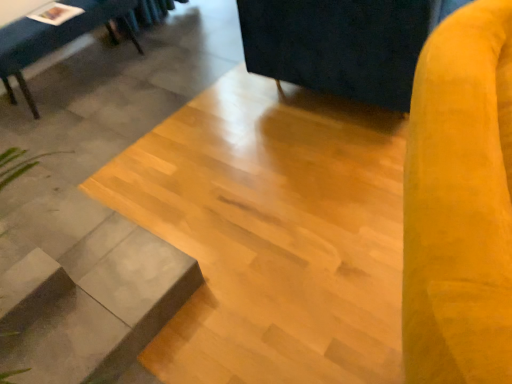
Locate an element on the screen. The width and height of the screenshot is (512, 384). matte black table at upper left is located at coordinates (55, 38).

What do you see at coordinates (55, 38) in the screenshot? This screenshot has width=512, height=384. I see `matte black table at upper left` at bounding box center [55, 38].

Based on the photo, measure the distance between velvet yellow swivel chair at right, the 1th swivel chair viewed from the back, and camera.

A distance of 4.82 feet exists between velvet yellow swivel chair at right, the 1th swivel chair viewed from the back, and camera.

Measure the distance between gray concrete at lower left and camera.

The distance of gray concrete at lower left from camera is 1.28 meters.

What do you see at coordinates (273, 234) in the screenshot? The image size is (512, 384). I see `gray concrete at lower left` at bounding box center [273, 234].

Image resolution: width=512 pixels, height=384 pixels. In order to click on matte black table at upper left in this screenshot , I will do coord(55,38).

From a real-world perspective, is matte black table at upper left over velvet yellow swivel chair at right, which is counted as the first swivel chair, starting from the front?

No, from a real-world perspective, matte black table at upper left is not on top of velvet yellow swivel chair at right, which is counted as the first swivel chair, starting from the front.

Is matte black table at upper left at the left side of velvet yellow swivel chair at right, acting as the second swivel chair starting from the back?

Yes.

In terms of size, does matte black table at upper left appear bigger or smaller than velvet yellow swivel chair at right, marked as the 1th swivel chair in a bottom-to-top arrangement?

Clearly, matte black table at upper left is smaller in size than velvet yellow swivel chair at right, marked as the 1th swivel chair in a bottom-to-top arrangement.

Between matte black table at upper left and velvet yellow swivel chair at right, which is the 2th swivel chair from top to bottom, which one is positioned behind?

Positioned behind is matte black table at upper left.

Does velvet yellow swivel chair at right, arranged as the first swivel chair when viewed from the top, contain velvet yellow swivel chair at right, marked as the 1th swivel chair in a bottom-to-top arrangement?

No, velvet yellow swivel chair at right, marked as the 1th swivel chair in a bottom-to-top arrangement, is not inside velvet yellow swivel chair at right, arranged as the first swivel chair when viewed from the top.

At what (x,y) coordinates should I click in order to perform the action: click on swivel chair that appears below the velvet yellow swivel chair at right, which is the 2th swivel chair from top to bottom (from a real-world perspective). Please return your answer as a coordinate pair (x, y). Looking at the image, I should click on (341, 44).

Considering the relative positions of velvet yellow swivel chair at right, arranged as the first swivel chair when viewed from the top, and velvet yellow swivel chair at right, which is the 2th swivel chair from top to bottom, in the image provided, is velvet yellow swivel chair at right, arranged as the first swivel chair when viewed from the top, to the left of velvet yellow swivel chair at right, which is the 2th swivel chair from top to bottom, from the viewer's perspective?

No.

Is velvet yellow swivel chair at right, the 1th swivel chair viewed from the back, positioned with its back to velvet yellow swivel chair at right, marked as the 1th swivel chair in a bottom-to-top arrangement?

velvet yellow swivel chair at right, the 1th swivel chair viewed from the back, does not have its back to velvet yellow swivel chair at right, marked as the 1th swivel chair in a bottom-to-top arrangement.

From the image's perspective, is velvet yellow swivel chair at right, arranged as the first swivel chair when viewed from the top, beneath gray concrete at lower left?

No, from the image's perspective, velvet yellow swivel chair at right, arranged as the first swivel chair when viewed from the top, is not beneath gray concrete at lower left.

Does velvet yellow swivel chair at right, arranged as the first swivel chair when viewed from the top, have a lesser width compared to gray concrete at lower left?

No.

Which point is more distant from viewer, (358, 17) or (370, 369)?

Positioned behind is point (358, 17).

Is velvet yellow swivel chair at right, which is counted as the first swivel chair, starting from the front, facing away from matte black table at upper left?

No, matte black table at upper left is not at the back of velvet yellow swivel chair at right, which is counted as the first swivel chair, starting from the front.

What's the angular difference between velvet yellow swivel chair at right, acting as the second swivel chair starting from the back, and matte black table at upper left's facing directions?

velvet yellow swivel chair at right, acting as the second swivel chair starting from the back, and matte black table at upper left are facing 22 degrees away from each other.

Which object is further away from the camera taking this photo, velvet yellow swivel chair at right, which is counted as the first swivel chair, starting from the front, or matte black table at upper left?

matte black table at upper left is further from the camera.

Is velvet yellow swivel chair at right, acting as the second swivel chair starting from the back, in contact with matte black table at upper left?

velvet yellow swivel chair at right, acting as the second swivel chair starting from the back, is not next to matte black table at upper left, and they're not touching.

Which is farther, (233, 169) or (50, 36)?

The point (50, 36) is farther from the camera.

Locate an element on the screen. The width and height of the screenshot is (512, 384). concrete lying below the matte black table at upper left (from the image's perspective) is located at coordinates (273, 234).

How much distance is there between gray concrete at lower left and matte black table at upper left?

A distance of 1.41 meters exists between gray concrete at lower left and matte black table at upper left.

What's the angular difference between gray concrete at lower left and matte black table at upper left's facing directions?

88.3 degrees separate the facing orientations of gray concrete at lower left and matte black table at upper left.

Considering the relative sizes of velvet yellow swivel chair at right, marked as the 1th swivel chair in a bottom-to-top arrangement, and velvet yellow swivel chair at right, the 1th swivel chair viewed from the back, in the image provided, is velvet yellow swivel chair at right, marked as the 1th swivel chair in a bottom-to-top arrangement, smaller than velvet yellow swivel chair at right, the 1th swivel chair viewed from the back,?

Yes.

Is velvet yellow swivel chair at right, acting as the second swivel chair starting from the back, looking in the opposite direction of velvet yellow swivel chair at right, arranged as the first swivel chair when viewed from the top?

That's not correct — velvet yellow swivel chair at right, acting as the second swivel chair starting from the back, is not looking away from velvet yellow swivel chair at right, arranged as the first swivel chair when viewed from the top.

How many degrees apart are the facing directions of velvet yellow swivel chair at right, which is counted as the first swivel chair, starting from the front, and velvet yellow swivel chair at right, which is counted as the 2th swivel chair, starting from the front?

velvet yellow swivel chair at right, which is counted as the first swivel chair, starting from the front, and velvet yellow swivel chair at right, which is counted as the 2th swivel chair, starting from the front, are facing 21.6 degrees away from each other.

In the image, there is a velvet yellow swivel chair at right, which is the 2th swivel chair from top to bottom. Where is `swivel chair below it (from a real-world perspective)`? This screenshot has height=384, width=512. swivel chair below it (from a real-world perspective) is located at coordinates (341, 44).

Visually, is gray concrete at lower left positioned to the left or to the right of velvet yellow swivel chair at right, arranged as the first swivel chair when viewed from the top?

gray concrete at lower left is positioned on velvet yellow swivel chair at right, arranged as the first swivel chair when viewed from the top,'s left side.

Is gray concrete at lower left turned away from velvet yellow swivel chair at right, arranged as the first swivel chair when viewed from the top?

gray concrete at lower left is not turned away from velvet yellow swivel chair at right, arranged as the first swivel chair when viewed from the top.

From their relative heights in the image, would you say gray concrete at lower left is taller or shorter than velvet yellow swivel chair at right, arranged as the first swivel chair when viewed from the top?

Clearly, gray concrete at lower left is shorter compared to velvet yellow swivel chair at right, arranged as the first swivel chair when viewed from the top.

Consider the image. Is gray concrete at lower left bigger than velvet yellow swivel chair at right, the 1th swivel chair viewed from the back?

Incorrect, gray concrete at lower left is not larger than velvet yellow swivel chair at right, the 1th swivel chair viewed from the back.

Locate an element on the screen. This screenshot has width=512, height=384. the 1st swivel chair counting from the right side of the matte black table at upper left is located at coordinates (460, 202).

At what (x,y) coordinates should I click in order to perform the action: click on swivel chair behind the velvet yellow swivel chair at right, which is the 2th swivel chair from top to bottom. Please return your answer as a coordinate pair (x, y). The width and height of the screenshot is (512, 384). Looking at the image, I should click on (341, 44).

Considering their positions, is velvet yellow swivel chair at right, which is the 2th swivel chair from top to bottom, positioned closer to velvet yellow swivel chair at right, which is counted as the second swivel chair, starting from the bottom, than gray concrete at lower left?

gray concrete at lower left is positioned closer to the anchor velvet yellow swivel chair at right, which is counted as the second swivel chair, starting from the bottom.

Considering their positions, is matte black table at upper left positioned closer to gray concrete at lower left than velvet yellow swivel chair at right, arranged as the first swivel chair when viewed from the top?

Among the two, velvet yellow swivel chair at right, arranged as the first swivel chair when viewed from the top, is located nearer to gray concrete at lower left.

Estimate the real-world distances between objects in this image. Which object is closer to velvet yellow swivel chair at right, which is counted as the second swivel chair, starting from the bottom, velvet yellow swivel chair at right, marked as the 1th swivel chair in a bottom-to-top arrangement, or matte black table at upper left?

velvet yellow swivel chair at right, marked as the 1th swivel chair in a bottom-to-top arrangement, is positioned closer to the anchor velvet yellow swivel chair at right, which is counted as the second swivel chair, starting from the bottom.

Looking at the image, which one is located further to gray concrete at lower left, velvet yellow swivel chair at right, which is counted as the second swivel chair, starting from the bottom, or velvet yellow swivel chair at right, which is the 2th swivel chair from top to bottom?

velvet yellow swivel chair at right, which is the 2th swivel chair from top to bottom.

From the image, which object appears to be farther from velvet yellow swivel chair at right, which is counted as the 2th swivel chair, starting from the front, gray concrete at lower left or velvet yellow swivel chair at right, which is the 2th swivel chair from top to bottom?

The object further to velvet yellow swivel chair at right, which is counted as the 2th swivel chair, starting from the front, is velvet yellow swivel chair at right, which is the 2th swivel chair from top to bottom.

Estimate the real-world distances between objects in this image. Which object is closer to matte black table at upper left, velvet yellow swivel chair at right, acting as the second swivel chair starting from the back, or gray concrete at lower left?

gray concrete at lower left is positioned closer to the anchor matte black table at upper left.

When comparing their distances from velvet yellow swivel chair at right, marked as the 1th swivel chair in a bottom-to-top arrangement, does matte black table at upper left or gray concrete at lower left seem further?

matte black table at upper left lies further to velvet yellow swivel chair at right, marked as the 1th swivel chair in a bottom-to-top arrangement, than the other object.

Based on their spatial positions, is matte black table at upper left or gray concrete at lower left further from velvet yellow swivel chair at right, arranged as the first swivel chair when viewed from the top?

matte black table at upper left is positioned further to the anchor velvet yellow swivel chair at right, arranged as the first swivel chair when viewed from the top.

Where is `concrete between matte black table at upper left and velvet yellow swivel chair at right, which is counted as the second swivel chair, starting from the bottom, in the horizontal direction`? concrete between matte black table at upper left and velvet yellow swivel chair at right, which is counted as the second swivel chair, starting from the bottom, in the horizontal direction is located at coordinates (273, 234).

Locate an element on the screen. concrete located between velvet yellow swivel chair at right, which is counted as the first swivel chair, starting from the front, and matte black table at upper left in the depth direction is located at coordinates (273, 234).

The image size is (512, 384). Identify the location of swivel chair between matte black table at upper left and velvet yellow swivel chair at right, arranged as the first swivel chair when viewed from the top, from left to right. (460, 202).

Locate an element on the screen. This screenshot has height=384, width=512. concrete between velvet yellow swivel chair at right, arranged as the first swivel chair when viewed from the top, and velvet yellow swivel chair at right, which is the 2th swivel chair from top to bottom, in the up-down direction is located at coordinates (273, 234).